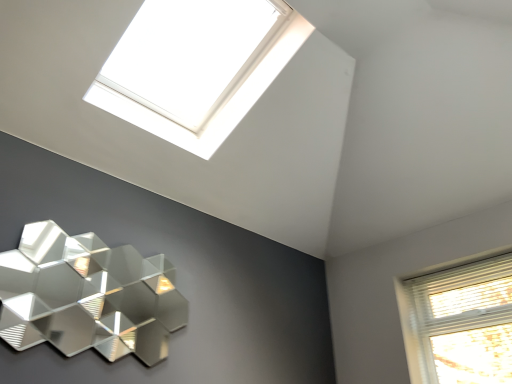
Question: Considering the positions of metallic hexagonal lamp at lower left and white plastic window at upper center in the image, is metallic hexagonal lamp at lower left bigger or smaller than white plastic window at upper center?

Choices:
 (A) small
 (B) big

Answer: (A)

Question: In terms of height, does metallic hexagonal lamp at lower left look taller or shorter compared to white plastic window at upper center?

Choices:
 (A) short
 (B) tall

Answer: (B)

Question: From the image's perspective, relative to white plastic window at upper center, is metallic hexagonal lamp at lower left above or below?

Choices:
 (A) above
 (B) below

Answer: (B)

Question: From a real-world perspective, is white plastic window at upper center physically located above or below metallic hexagonal lamp at lower left?

Choices:
 (A) above
 (B) below

Answer: (A)

Question: Looking at the image, does white plastic window at upper center seem bigger or smaller compared to metallic hexagonal lamp at lower left?

Choices:
 (A) small
 (B) big

Answer: (B)

Question: From the image's perspective, is white plastic window at upper center positioned above or below metallic hexagonal lamp at lower left?

Choices:
 (A) below
 (B) above

Answer: (B)

Question: Do you think white plastic window at upper center is within metallic hexagonal lamp at lower left, or outside of it?

Choices:
 (A) inside
 (B) outside

Answer: (B)